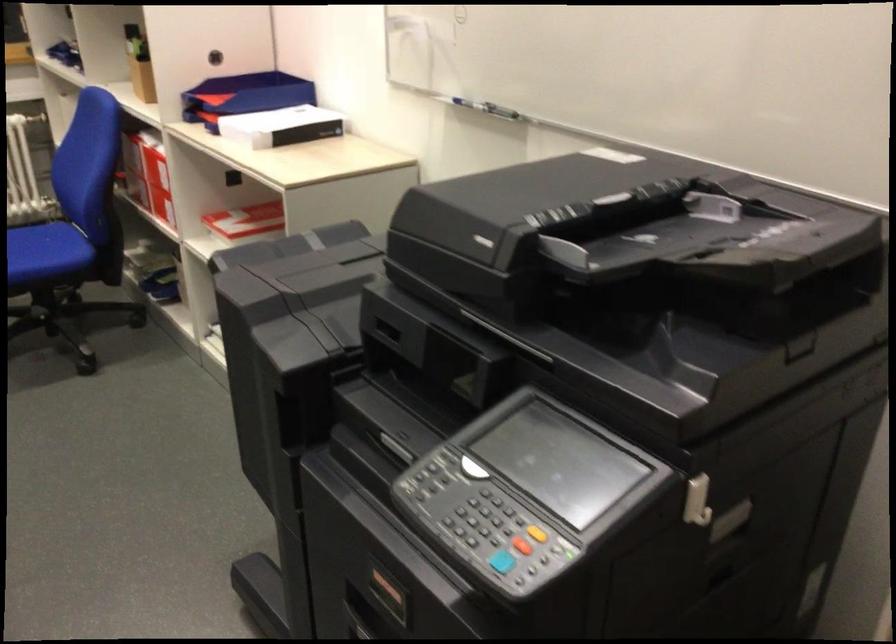
Where would you press the blue printer button? Please return your answer as a coordinate pair (x, y).

(502, 562)